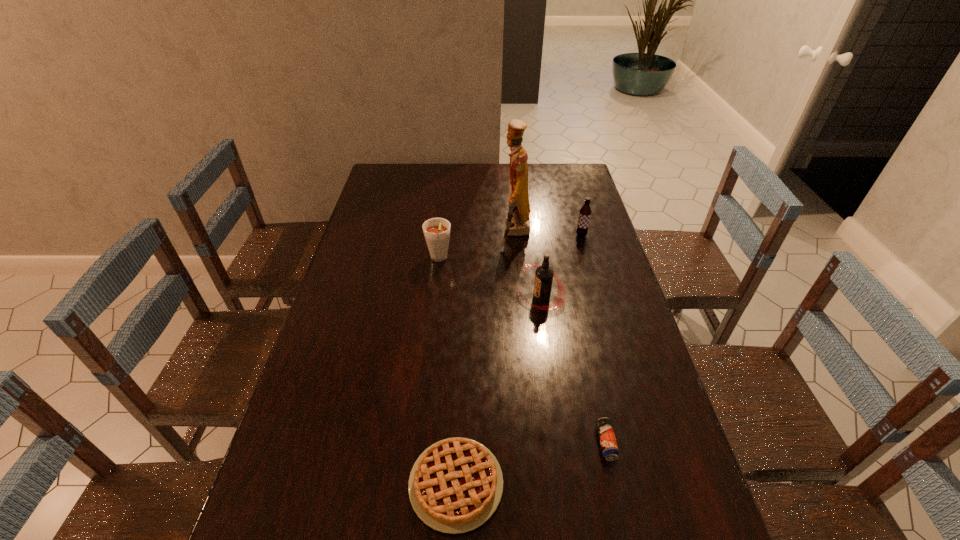
Find the location of a particular element. This screenshot has width=960, height=540. empty location between the second nearest root beer and the beer can is located at coordinates (522, 351).

I want to click on empty location between the pie and the farthest root beer, so 518,360.

Find the location of a particular element. The width and height of the screenshot is (960, 540). object that stands as the second closest to the tallest object is located at coordinates tap(544, 273).

This screenshot has height=540, width=960. Find the location of `object that can be found as the third closest to the nearest root beer`. object that can be found as the third closest to the nearest root beer is located at coordinates (585, 212).

Image resolution: width=960 pixels, height=540 pixels. Identify the location of root beer object that ranks as the second closest to the nutcracker. (544, 273).

At what (x,y) coordinates should I click in order to perform the action: click on root beer that stands as the closest to the nearest root beer. Please return your answer as a coordinate pair (x, y). The image size is (960, 540). Looking at the image, I should click on (436, 231).

Where is `free space that satisfies the following two spatial constraints: 1. on the front-facing side of the nutcracker; 2. on the left side of the farthest root beer`? The height and width of the screenshot is (540, 960). free space that satisfies the following two spatial constraints: 1. on the front-facing side of the nutcracker; 2. on the left side of the farthest root beer is located at coordinates (516, 235).

The width and height of the screenshot is (960, 540). What are the coordinates of `free region that satisfies the following two spatial constraints: 1. on the drink side of the beer can; 2. on the right side of the leftmost root beer` in the screenshot? It's located at (419, 443).

Find the location of `vacant position in the image that satisfies the following two spatial constraints: 1. on the label of the beer can; 2. on the right side of the second root beer from left to right`. vacant position in the image that satisfies the following two spatial constraints: 1. on the label of the beer can; 2. on the right side of the second root beer from left to right is located at coordinates (562, 443).

Locate an element on the screen. free space in the image that satisfies the following two spatial constraints: 1. on the front-facing side of the tallest object; 2. on the back side of the rightmost object is located at coordinates (516, 235).